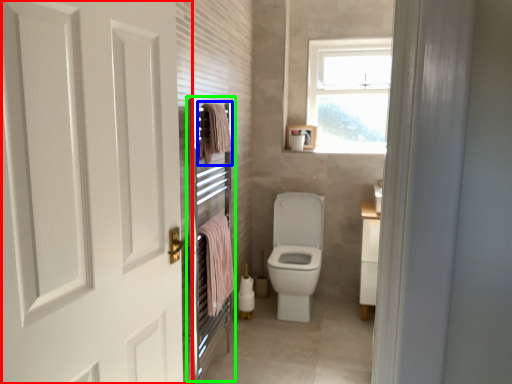
Question: Which is farther away from door (highlighted by a red box)? bath towel (highlighted by a blue box) or screen door (highlighted by a green box)?

Choices:
 (A) bath towel
 (B) screen door

Answer: (A)